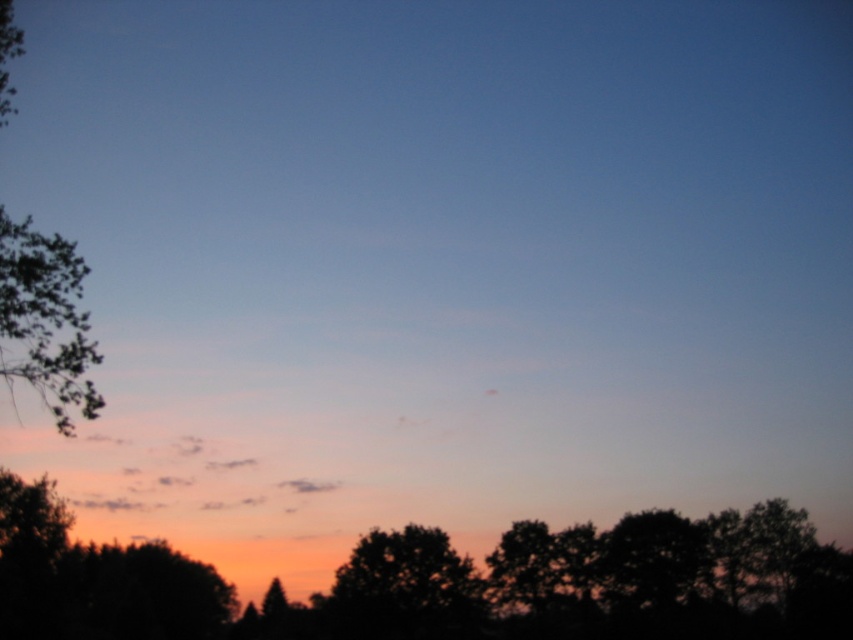
You are an artist trying to paint the sunset scene. You want to place the green leafy tree at left and the silhouette tree at center in your painting. Based on the scene description, which tree should you draw first to ensure proper positioning?

The green leafy tree at left should be drawn first because it is positioned on the left side of the silhouette tree at center, so starting with the leftmost tree ensures correct placement relative to the central silhouette tree.

You are an artist trying to paint the sunset scene. You notice two silhouette trees in the image. Which one has a wider base? The silhouette tree at lower center or the silhouette tree at center?

The silhouette tree at lower center has a wider base than the silhouette tree at center because its width surpasses the latter.

You are a hiker who wants to take a photo of the green leafy tree at left and the silhouette tree at center from a distance. If your camera can focus on objects up to 70 meters away, will you be able to capture both trees clearly in one photo?

The green leafy tree at left is 69.70 meters away from the silhouette tree at center. Since the camera can focus up to 70 meters, you can capture both trees clearly as their distance apart is within the camera range.